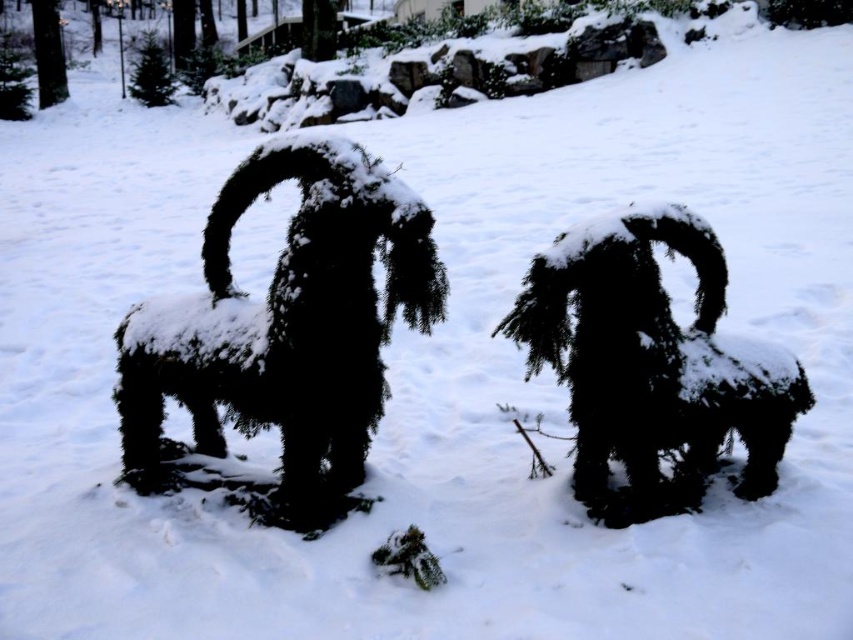
Question: Does green textured evergreen at center appear on the left side of fuzzy dark green bush at center?

Choices:
 (A) no
 (B) yes

Answer: (B)

Question: From the image, what is the correct spatial relationship of green textured evergreen at center in relation to fuzzy dark green bush at center?

Choices:
 (A) below
 (B) above

Answer: (B)

Question: Which of the following is the farthest from the observer?

Choices:
 (A) green textured evergreen at center
 (B) fuzzy dark green bush at center

Answer: (B)

Question: Observing the image, what is the correct spatial positioning of green textured evergreen at center in reference to fuzzy dark green bush at center?

Choices:
 (A) right
 (B) left

Answer: (B)